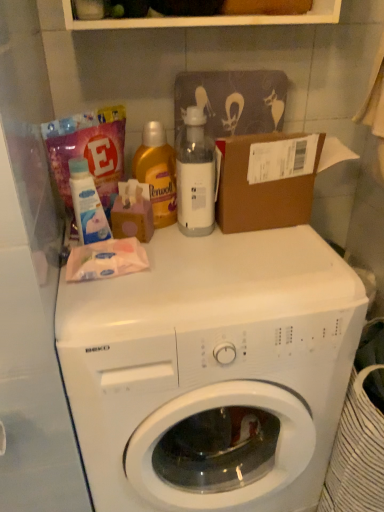
You are a GUI agent. You are given a task and a screenshot of the screen. Output one action in this format:
    pyautogui.click(x=<x>, y=<y>)
    Task: Click on the free spot in front of yellow liquid detergent at upper center, positioned as the second cleaning product in left-to-right order
    The width and height of the screenshot is (384, 512).
    Given the screenshot: What is the action you would take?
    pyautogui.click(x=174, y=257)